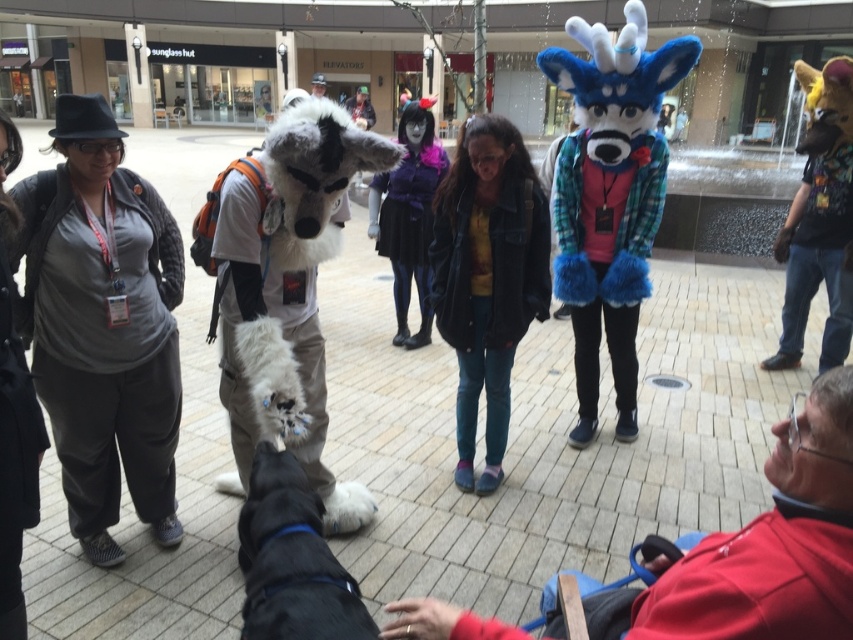
Question: Can you confirm if velvet blue plush at lower right is positioned to the left of purple furry costume at center?

Choices:
 (A) no
 (B) yes

Answer: (A)

Question: Is red fleece jacket at lower right to the left of velvet blue plush at lower right from the viewer's perspective?

Choices:
 (A) yes
 (B) no

Answer: (B)

Question: In this image, where is purple furry costume at center located relative to matte black hat at upper left?

Choices:
 (A) right
 (B) left

Answer: (A)

Question: Which object is the farthest from the red fleece jacket at lower right?

Choices:
 (A) black fur dog at lower left
 (B) denim jacket at center
 (C) velvet blue plush at lower right
 (D) matte black hat at upper left

Answer: (D)

Question: Based on their relative distances, which object is farther from the black furry costume at left?

Choices:
 (A) velvet blue plush at lower right
 (B) black fur dog at lower left

Answer: (A)

Question: Which object is the farthest from the black fur dog at lower left?

Choices:
 (A) gray fleece jacket at left
 (B) purple furry costume at center

Answer: (B)